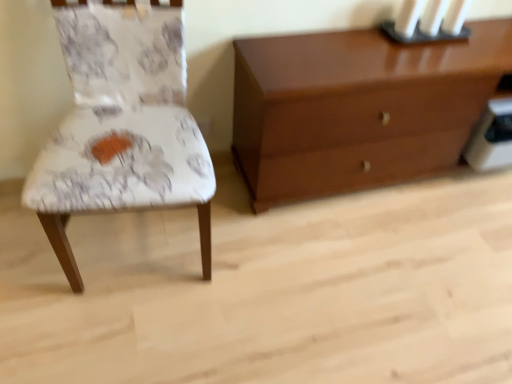
Question: From a real-world perspective, is glossy wood chest of drawers at upper right physically located above or below black matte candle holder at upper right?

Choices:
 (A) above
 (B) below

Answer: (B)

Question: From the image's perspective, is glossy wood chest of drawers at upper right above or below black matte candle holder at upper right?

Choices:
 (A) above
 (B) below

Answer: (B)

Question: Which object is positioned farthest from the black matte candle holder at upper right?

Choices:
 (A) white fabric chair at left
 (B) glossy wood chest of drawers at upper right

Answer: (A)

Question: Estimate the real-world distances between objects in this image. Which object is closer to the glossy wood chest of drawers at upper right?

Choices:
 (A) black matte candle holder at upper right
 (B) white fabric chair at left

Answer: (A)